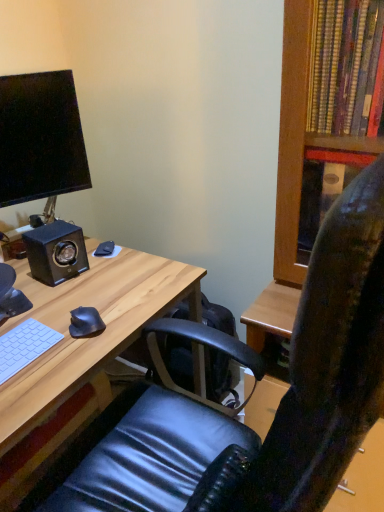
Identify the location of white matte keyboard at lower left. Image resolution: width=384 pixels, height=512 pixels. [x=24, y=346].

The height and width of the screenshot is (512, 384). What do you see at coordinates (79, 355) in the screenshot?
I see `light wood desk at center` at bounding box center [79, 355].

Where is `black matte speaker at left`? The image size is (384, 512). black matte speaker at left is located at coordinates (56, 252).

Between black matte mouse at lower left, marked as the 1th mouse in a front-to-back arrangement, and matte black monitor at upper left, which one has larger size?

With larger size is matte black monitor at upper left.

Would you say black matte mouse at lower left, marked as the 1th mouse in a front-to-back arrangement, contains matte black monitor at upper left?

No, matte black monitor at upper left is not a part of black matte mouse at lower left, marked as the 1th mouse in a front-to-back arrangement.

Does black matte mouse at lower left, marked as the second mouse in a top-to-bottom arrangement, have a lesser height compared to matte black monitor at upper left?

Yes.

Are black matte mouse at lower left, marked as the second mouse in a top-to-bottom arrangement, and matte black monitor at upper left making contact?

They are not placed beside each other.

Find the location of a particular element. The width and height of the screenshot is (384, 512). computer keyboard in front of the matte black monitor at upper left is located at coordinates (24, 346).

Is matte black monitor at upper left oriented away from white matte keyboard at lower left?

matte black monitor at upper left is not turned away from white matte keyboard at lower left.

Is matte black monitor at upper left further to the viewer compared to white matte keyboard at lower left?

That is True.

Is light wood desk at center outside of black matte mouse at lower left, marked as the second mouse in a top-to-bottom arrangement?

light wood desk at center lies outside black matte mouse at lower left, marked as the second mouse in a top-to-bottom arrangement,'s area.

Is light wood desk at center looking in the opposite direction of black matte mouse at lower left, which appears as the 2th mouse when viewed from the back?

No.

Between light wood desk at center and black matte mouse at lower left, marked as the 1th mouse in a front-to-back arrangement, which one has larger width?

light wood desk at center.

Is light wood desk at center in front of black matte mouse at lower left, marked as the 1th mouse in a front-to-back arrangement?

Yes, it is in front of black matte mouse at lower left, marked as the 1th mouse in a front-to-back arrangement.

Is point (39, 232) positioned after point (103, 245)?

No, it is not.

Looking at this image, can you confirm if black matte speaker at left is positioned to the left of black matte mouse at lower left, the second mouse when ordered from bottom to top?

Yes, black matte speaker at left is to the left of black matte mouse at lower left, the second mouse when ordered from bottom to top.

Is black matte speaker at left looking in the opposite direction of black matte mouse at lower left, the second mouse when ordered from bottom to top?

black matte speaker at left is not turned away from black matte mouse at lower left, the second mouse when ordered from bottom to top.

From the image's perspective, is black leather chair at center above matte black monitor at upper left?

Actually, black leather chair at center appears below matte black monitor at upper left in the image.

Considering the relative sizes of black leather chair at center and matte black monitor at upper left in the image provided, is black leather chair at center shorter than matte black monitor at upper left?

No.

Locate an element on the screen. The image size is (384, 512). computer monitor that appears above the black leather chair at center (from a real-world perspective) is located at coordinates (40, 138).

Is black leather chair at center in front of or behind matte black monitor at upper left in the image?

black leather chair at center is positioned closer to the viewer than matte black monitor at upper left.

From a real-world perspective, starting from the white matte keyboard at lower left, which mouse is the 1st one vertically above it? Please provide its 2D coordinates.

[(104, 249)]

Which object is thinner, black matte mouse at lower left, which is counted as the 2th mouse, starting from the front, or white matte keyboard at lower left?

black matte mouse at lower left, which is counted as the 2th mouse, starting from the front, is thinner.

Which of these two, black matte mouse at lower left, the 1th mouse when ordered from top to bottom, or white matte keyboard at lower left, is bigger?

Bigger between the two is white matte keyboard at lower left.

Does black matte mouse at lower left, which is counted as the 2th mouse, starting from the front, touch white matte keyboard at lower left?

No, black matte mouse at lower left, which is counted as the 2th mouse, starting from the front, is not next to white matte keyboard at lower left.

Is there a large distance between black matte mouse at lower left, which is counted as the 2th mouse, starting from the front, and matte black monitor at upper left?

No, there isn't a large distance between black matte mouse at lower left, which is counted as the 2th mouse, starting from the front, and matte black monitor at upper left.

You are a GUI agent. You are given a task and a screenshot of the screen. Output one action in this format:
    pyautogui.click(x=<x>, y=<y>)
    Task: Click on the mouse lying behind the matte black monitor at upper left
    The image size is (384, 512).
    Given the screenshot: What is the action you would take?
    pyautogui.click(x=104, y=249)

Considering the positions of objects black matte mouse at lower left, the second mouse when ordered from bottom to top, and matte black monitor at upper left in the image provided, who is behind, black matte mouse at lower left, the second mouse when ordered from bottom to top, or matte black monitor at upper left?

black matte mouse at lower left, the second mouse when ordered from bottom to top, is more distant.

From the image's perspective, who appears lower, black matte mouse at lower left, which is counted as the 2th mouse, starting from the front, or matte black monitor at upper left?

black matte mouse at lower left, which is counted as the 2th mouse, starting from the front, from the image's perspective.

In the image, there is a black matte mouse at lower left, the 1th mouse from the bottom. Where is `computer monitor above it (from the image's perspective)`? computer monitor above it (from the image's perspective) is located at coordinates (40, 138).

In order to click on computer keyboard on the right side of matte black monitor at upper left in this screenshot , I will do `click(24, 346)`.

From the image, which object appears to be farther from black leather chair at center, black matte speaker at left or white matte keyboard at lower left?

black matte speaker at left lies further to black leather chair at center than the other object.

Estimate the real-world distances between objects in this image. Which object is further from black matte mouse at lower left, marked as the second mouse in a top-to-bottom arrangement, light wood desk at center or black leather chair at center?

black leather chair at center.

Which object lies nearer to the anchor point white matte keyboard at lower left, black matte mouse at lower left, the second mouse when ordered from bottom to top, or black leather chair at center?

The object closer to white matte keyboard at lower left is black leather chair at center.

Considering their positions, is black leather chair at center positioned closer to white matte keyboard at lower left than black matte mouse at lower left, the 1th mouse from the bottom?

Based on the image, black matte mouse at lower left, the 1th mouse from the bottom, appears to be nearer to white matte keyboard at lower left.

Estimate the real-world distances between objects in this image. Which object is closer to white matte keyboard at lower left, black leather chair at center or matte black monitor at upper left?

The object closer to white matte keyboard at lower left is black leather chair at center.

Looking at this image, estimate the real-world distances between objects in this image. Which object is closer to matte black monitor at upper left, black matte mouse at lower left, the second mouse when ordered from bottom to top, or light wood desk at center?

black matte mouse at lower left, the second mouse when ordered from bottom to top.

Estimate the real-world distances between objects in this image. Which object is closer to black matte mouse at lower left, the 1th mouse from the bottom, black matte mouse at lower left, the 1th mouse when ordered from top to bottom, or black leather chair at center?

The object closer to black matte mouse at lower left, the 1th mouse from the bottom, is black matte mouse at lower left, the 1th mouse when ordered from top to bottom.

Considering their positions, is black leather chair at center positioned closer to matte black monitor at upper left than black matte mouse at lower left, the second mouse when ordered from bottom to top?

The object closer to matte black monitor at upper left is black matte mouse at lower left, the second mouse when ordered from bottom to top.

Find the location of a particular element. The width and height of the screenshot is (384, 512). mouse between matte black monitor at upper left and black matte speaker at left from top to bottom is located at coordinates (104, 249).

I want to click on computer monitor positioned between black leather chair at center and black matte mouse at lower left, which is counted as the 2th mouse, starting from the front, from near to far, so click(x=40, y=138).

You are a GUI agent. You are given a task and a screenshot of the screen. Output one action in this format:
    pyautogui.click(x=<x>, y=<y>)
    Task: Click on the desk between black leather chair at center and black matte mouse at lower left, marked as the 1th mouse in a front-to-back arrangement, in the front-back direction
    The width and height of the screenshot is (384, 512).
    Given the screenshot: What is the action you would take?
    pyautogui.click(x=79, y=355)

Find the location of a particular element. computer keyboard positioned between black leather chair at center and black matte speaker at left from near to far is located at coordinates (24, 346).